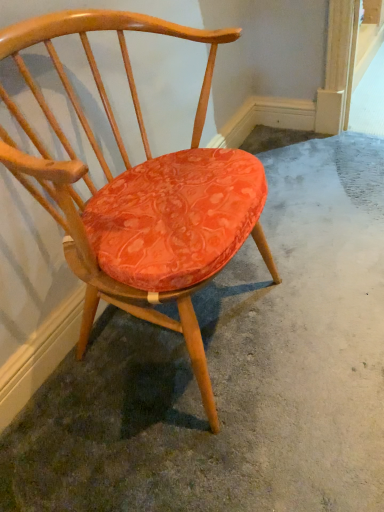
Question: Considering the positions of orange fabric cushion at center and matte orange cushioned chair at center in the image, is orange fabric cushion at center taller or shorter than matte orange cushioned chair at center?

Choices:
 (A) tall
 (B) short

Answer: (B)

Question: Would you say orange fabric cushion at center is inside or outside matte orange cushioned chair at center?

Choices:
 (A) outside
 (B) inside

Answer: (A)

Question: Considering the positions of point (362, 301) and point (210, 243), is point (362, 301) closer or farther from the camera than point (210, 243)?

Choices:
 (A) farther
 (B) closer

Answer: (A)

Question: Is point (139, 247) closer or farther from the camera than point (97, 428)?

Choices:
 (A) closer
 (B) farther

Answer: (A)

Question: From a real-world perspective, is matte orange cushioned chair at center above or below orange fabric cushion at center?

Choices:
 (A) below
 (B) above

Answer: (B)

Question: Is matte orange cushioned chair at center wider or thinner than orange fabric cushion at center?

Choices:
 (A) thin
 (B) wide

Answer: (A)

Question: From their relative heights in the image, would you say matte orange cushioned chair at center is taller or shorter than orange fabric cushion at center?

Choices:
 (A) tall
 (B) short

Answer: (A)